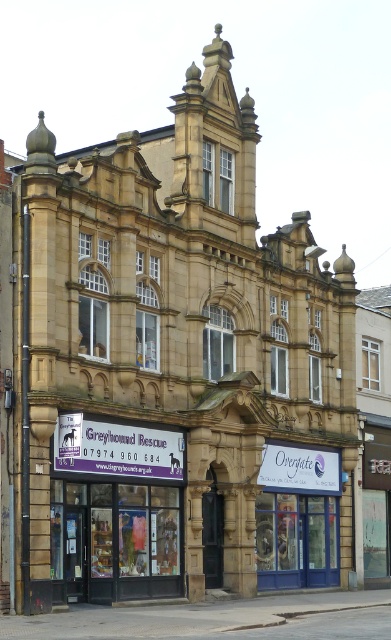
How much distance is there between purple fabric sign at lower center and white plastic sign at center?

They are 13.66 meters apart.

Can you confirm if purple fabric sign at lower center is positioned above white plastic sign at center?

Indeed, purple fabric sign at lower center is positioned over white plastic sign at center.

Where is `purple fabric sign at lower center`? Image resolution: width=391 pixels, height=640 pixels. purple fabric sign at lower center is located at coordinates (116, 449).

The width and height of the screenshot is (391, 640). Identify the location of purple fabric sign at lower center. (116, 449).